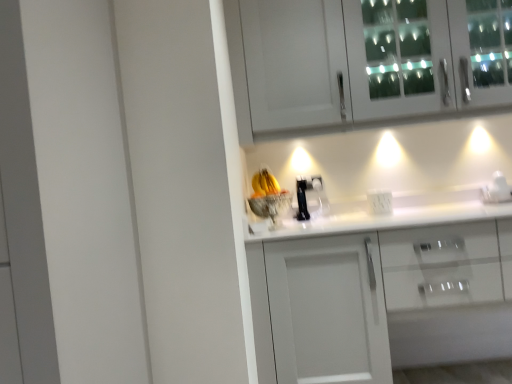
Question: Is point (499, 188) positioned closer to the camera than point (266, 301)?

Choices:
 (A) farther
 (B) closer

Answer: (A)

Question: Is white glossy coffee maker at right to the left or to the right of white glossy cabinet at center, the second cabinetry viewed from the top, in the image?

Choices:
 (A) right
 (B) left

Answer: (A)

Question: Which of these objects is positioned farthest from the white glass cabinet at upper center, which is the 2th cabinetry from bottom to top?

Choices:
 (A) white glossy cabinet at center, which is counted as the first cabinetry, starting from the bottom
 (B) white plastic electric outlet at center
 (C) white glossy coffee maker at right

Answer: (C)

Question: Estimate the real-world distances between objects in this image. Which object is farther from the white glossy coffee maker at right?

Choices:
 (A) white glossy cabinet at center, which is counted as the first cabinetry, starting from the bottom
 (B) white glass cabinet at upper center, which is the 2th cabinetry from bottom to top
 (C) white plastic electric outlet at center

Answer: (B)